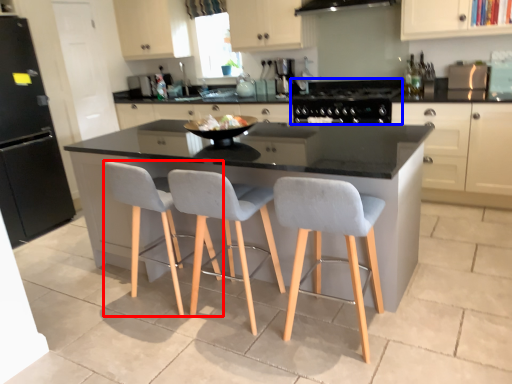
Question: Which of the following is the farthest to the observer, chair (highlighted by a red box) or gas stove (highlighted by a blue box)?

Choices:
 (A) chair
 (B) gas stove

Answer: (B)